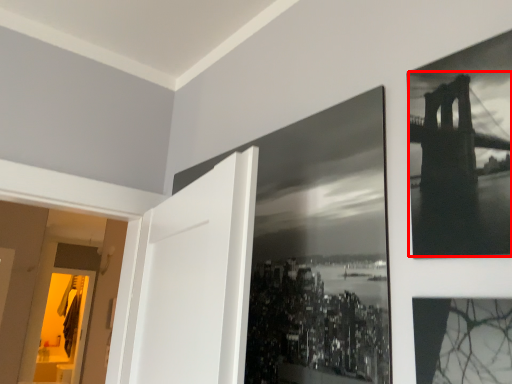
Question: From the image's perspective, where is Golden Gate Bridge (annotated by the red box) located in relation to picture frame in the image?

Choices:
 (A) below
 (B) above

Answer: (B)